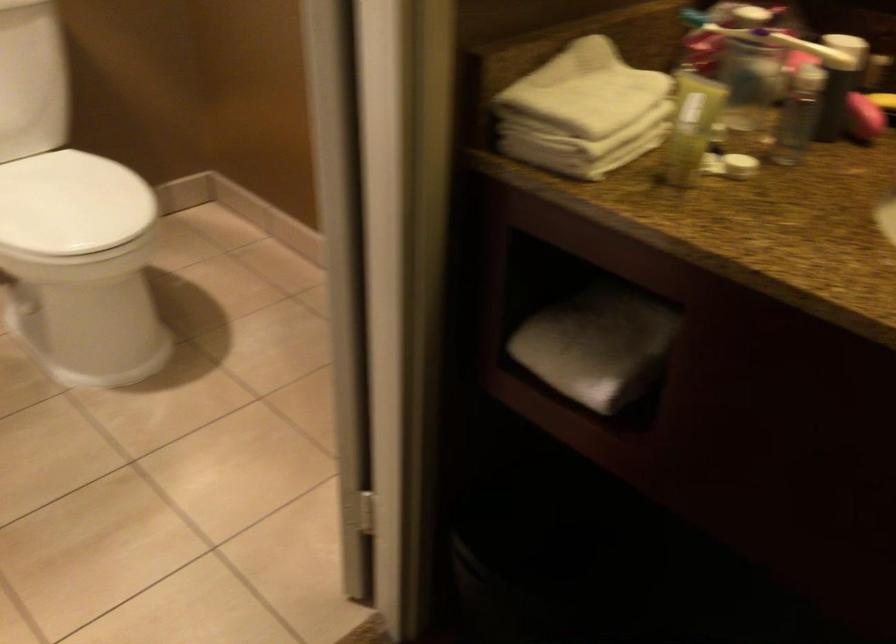
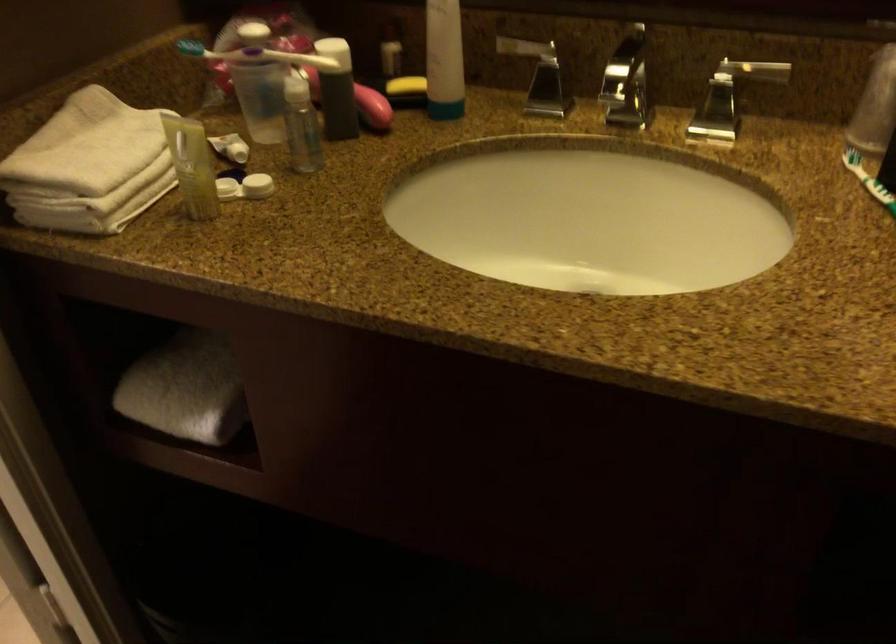
The point at [586,108] is marked in the first image. Where is the corresponding point in the second image?

(89, 166)